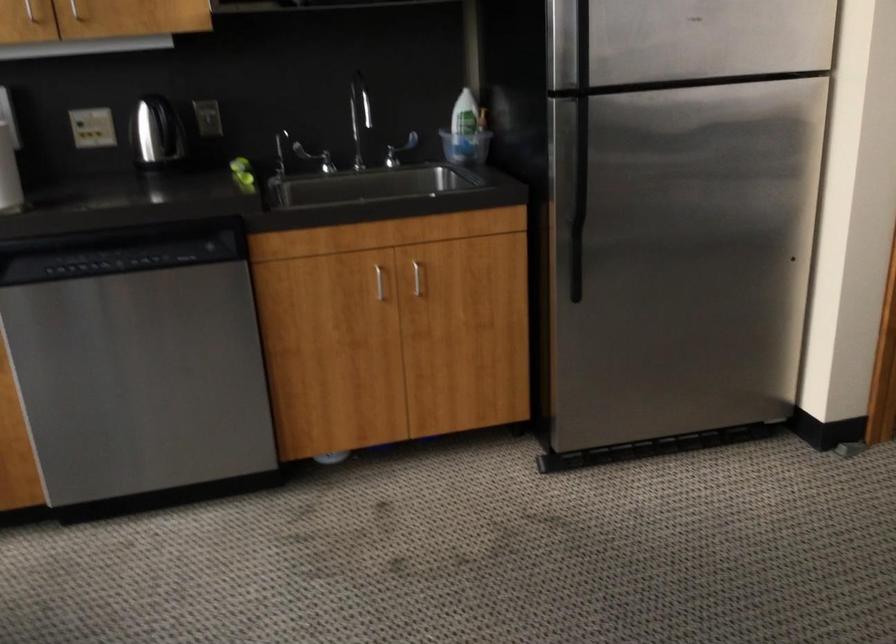
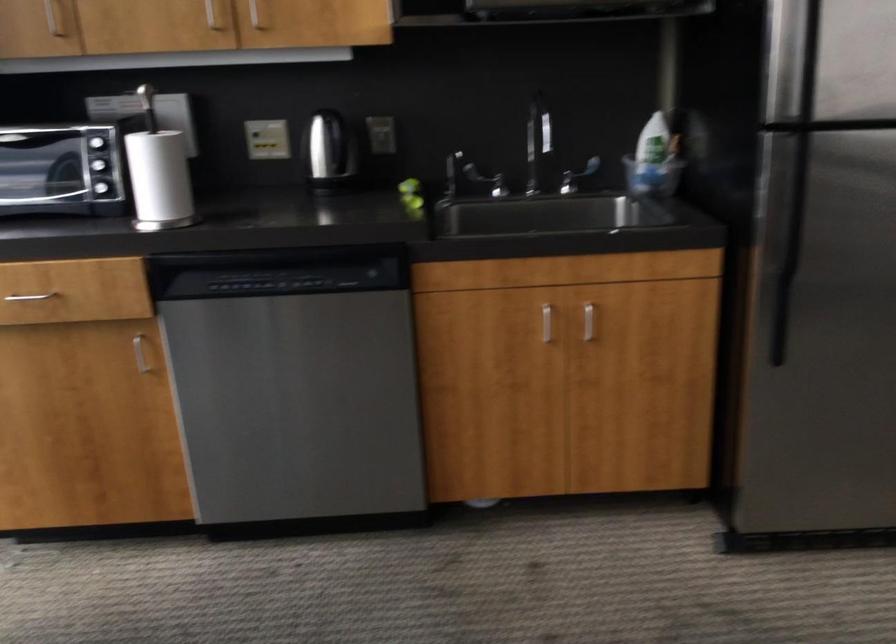
In the second image, find the point that corresponds to [394,149] in the first image.

(576, 176)